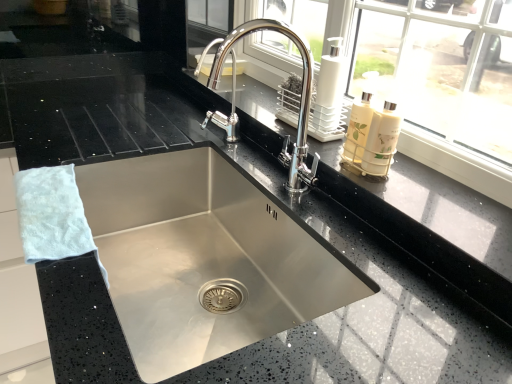
This screenshot has height=384, width=512. In order to click on free space underneath polished chrome faucet at center (from a real-world perspective) in this screenshot , I will do `click(281, 190)`.